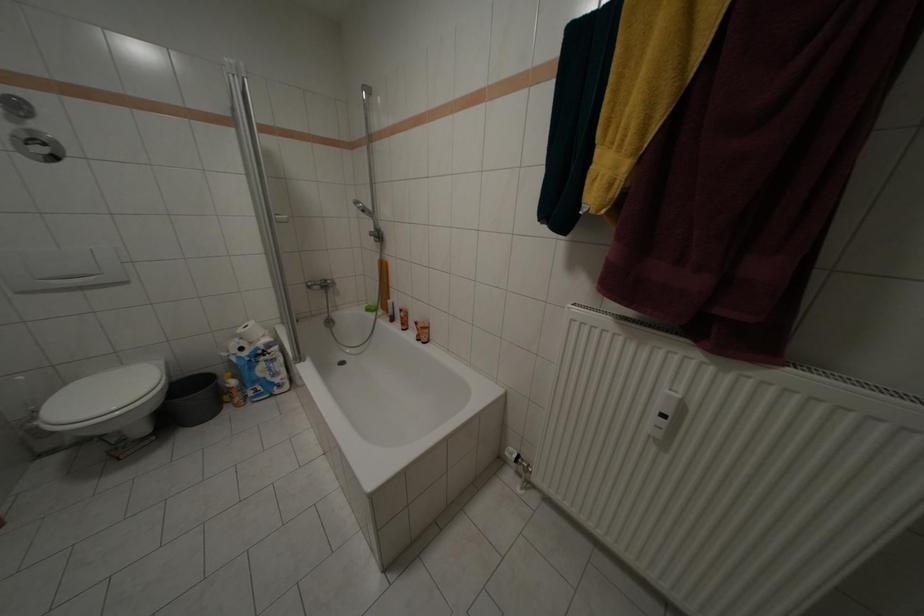
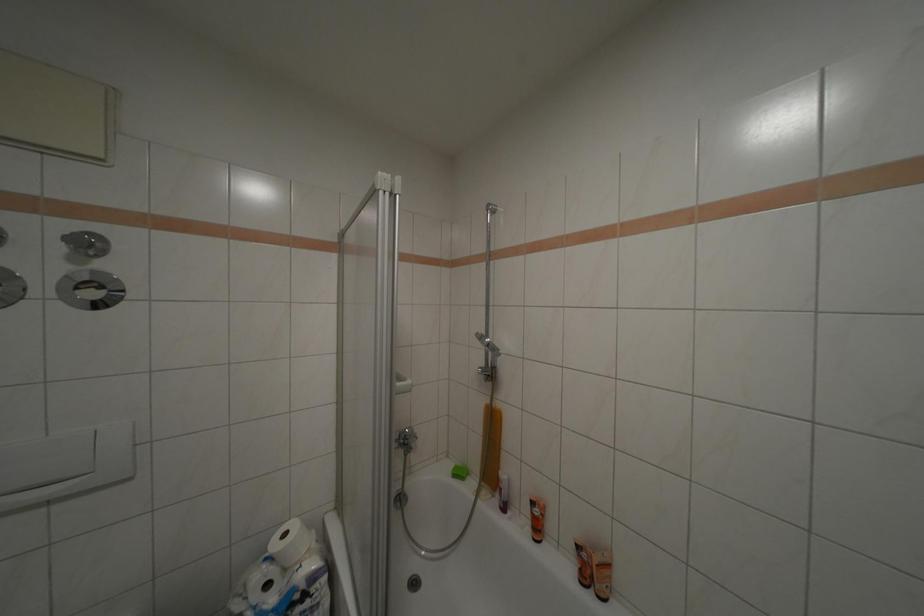
What movement of the cameraman would produce the second image?

The cameraman walked toward left, forward.